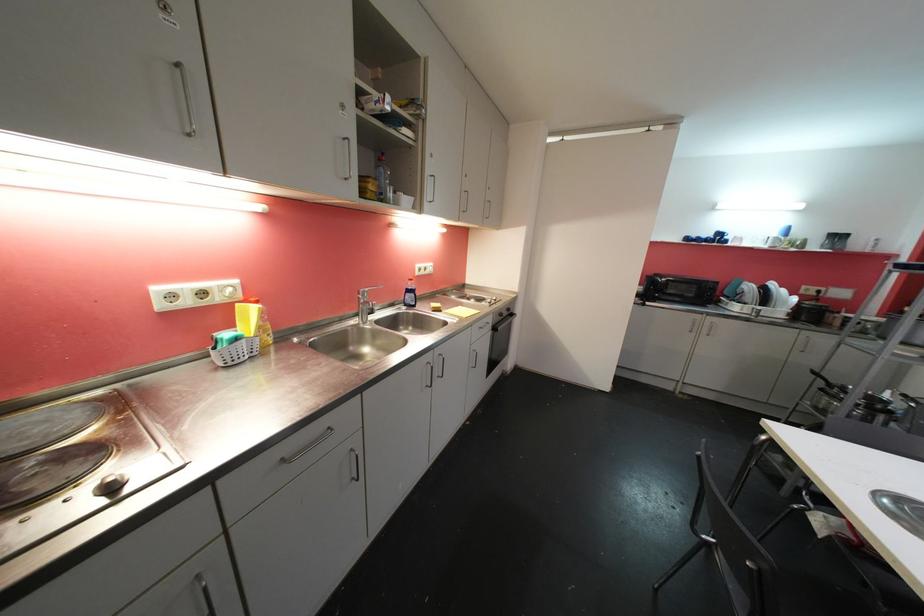
Image resolution: width=924 pixels, height=616 pixels. Find the location of `metal drawer handle`. metal drawer handle is located at coordinates (308, 447).